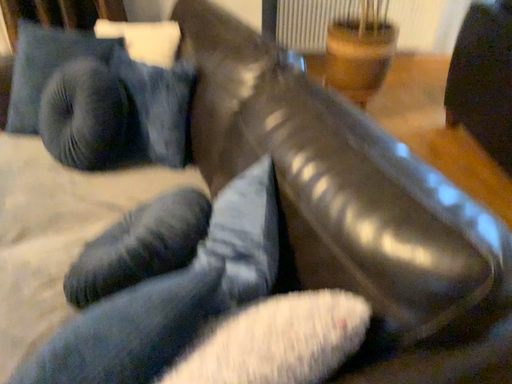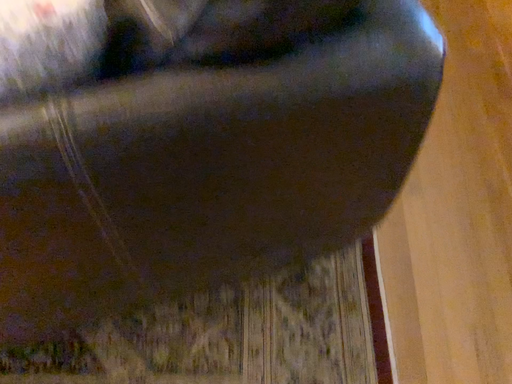
Question: How did the camera likely rotate when shooting the video?

Choices:
 (A) rotated downward
 (B) rotated upward

Answer: (A)